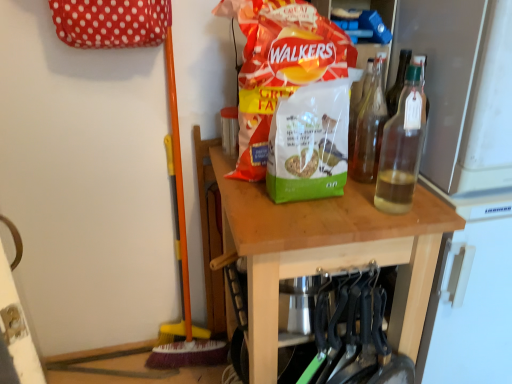
Question: In the image, is matte plastic bag of walkers crisps at center, arranged as the first waste when viewed from the top, on the left side or the right side of wooden table at center?

Choices:
 (A) left
 (B) right

Answer: (A)

Question: Is point (300, 79) closer or farther from the camera than point (256, 281)?

Choices:
 (A) farther
 (B) closer

Answer: (A)

Question: Estimate the real-world distances between objects in this image. Which object is farther from the translucent glass bottle at center right, which appears as the 2th bottle when viewed from the front?

Choices:
 (A) clear glass bottle at upper right, which is the first bottle in front-to-back order
 (B) matte plastic bag of walkers crisps at center, the second waste positioned from the bottom
 (C) green matte birdseed bag at center, which is the second waste in top-to-bottom order
 (D) wooden table at center

Answer: (D)

Question: Considering the real-world distances, which object is farthest from the green matte birdseed bag at center, which is the second waste in top-to-bottom order?

Choices:
 (A) clear glass bottle at upper right, which is counted as the second bottle, starting from the back
 (B) matte plastic bag of walkers crisps at center, the second waste positioned from the bottom
 (C) translucent glass bottle at center right, which appears as the 2th bottle when viewed from the front
 (D) wooden table at center

Answer: (C)